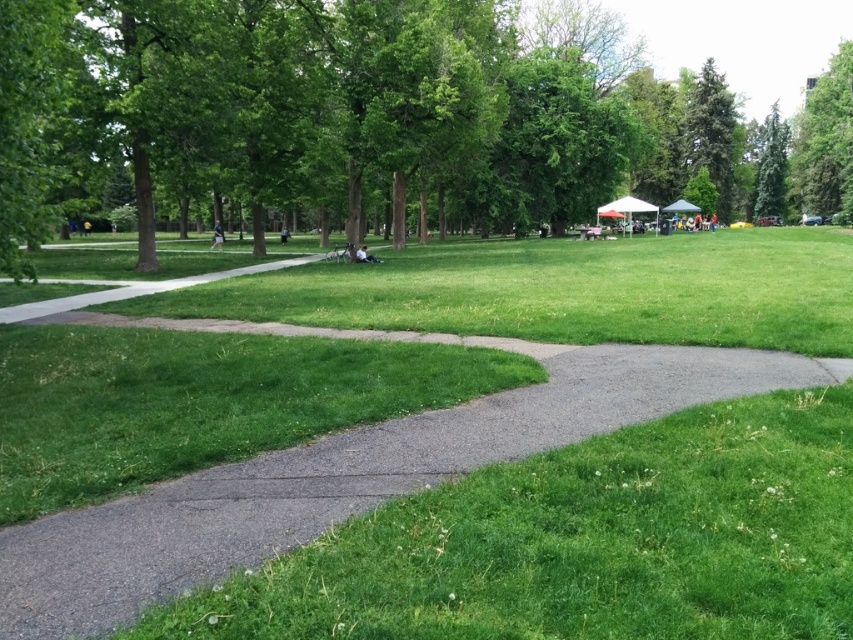
You are a hiker standing on the curving paved pathway in the foreground of the park. You want to take a photo of the green leafy tree at center and the green leafy tree at upper right. Which tree should you focus on first to ensure both are in the frame?

You should focus on the green leafy tree at center first since it is closer to you, allowing you to adjust the camera to include both it and the green leafy tree at upper right in the frame.